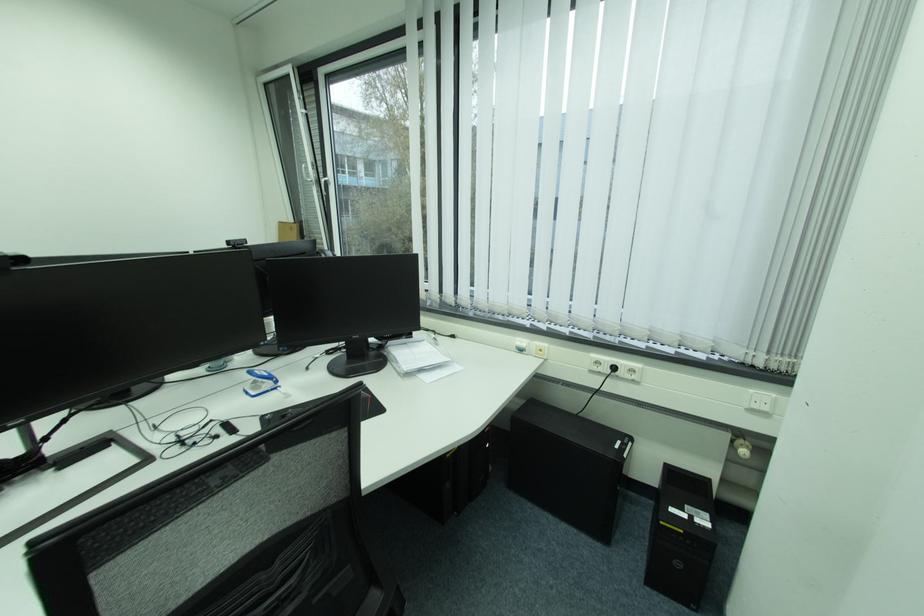
This screenshot has width=924, height=616. What do you see at coordinates (306, 172) in the screenshot?
I see `a window handle` at bounding box center [306, 172].